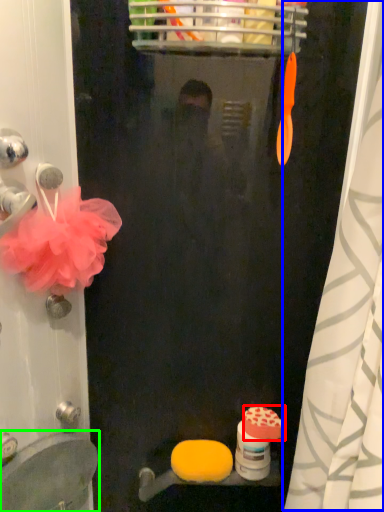
Question: Which object is the closest to the soap (highlighted by a red box)? Choose among these: shower curtain (highlighted by a blue box) or sink (highlighted by a green box).

Choices:
 (A) shower curtain
 (B) sink

Answer: (B)